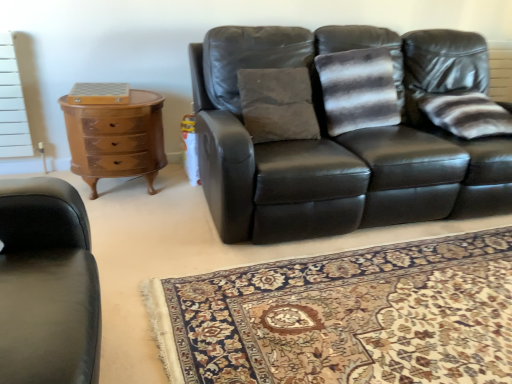
Question: From the image's perspective, is carpet with intricate floral pattern at center over striped fabric pillow at right?

Choices:
 (A) yes
 (B) no

Answer: (B)

Question: Does carpet with intricate floral pattern at center appear on the left side of striped fabric pillow at right?

Choices:
 (A) yes
 (B) no

Answer: (A)

Question: Does carpet with intricate floral pattern at center have a lesser height compared to striped fabric pillow at right?

Choices:
 (A) no
 (B) yes

Answer: (B)

Question: Does carpet with intricate floral pattern at center have a larger size compared to striped fabric pillow at right?

Choices:
 (A) yes
 (B) no

Answer: (A)

Question: Is striped fabric pillow at right surrounded by carpet with intricate floral pattern at center?

Choices:
 (A) no
 (B) yes

Answer: (A)

Question: In terms of height, does carpet with intricate floral pattern at center look taller or shorter compared to matte black leather couch at center?

Choices:
 (A) tall
 (B) short

Answer: (B)

Question: From a real-world perspective, is carpet with intricate floral pattern at center above or below matte black leather couch at center?

Choices:
 (A) above
 (B) below

Answer: (B)

Question: Is carpet with intricate floral pattern at center wider or thinner than matte black leather couch at center?

Choices:
 (A) thin
 (B) wide

Answer: (B)

Question: Is point (271, 372) closer or farther from the camera than point (268, 104)?

Choices:
 (A) farther
 (B) closer

Answer: (B)

Question: Is wooden glossy chest of drawers at left inside or outside of matte black leather couch at center?

Choices:
 (A) inside
 (B) outside

Answer: (B)

Question: From their relative heights in the image, would you say wooden glossy chest of drawers at left is taller or shorter than matte black leather couch at center?

Choices:
 (A) tall
 (B) short

Answer: (B)

Question: Looking at the image, does wooden glossy chest of drawers at left seem bigger or smaller compared to matte black leather couch at center?

Choices:
 (A) big
 (B) small

Answer: (B)

Question: Relative to matte black leather couch at center, is wooden glossy chest of drawers at left in front or behind?

Choices:
 (A) front
 (B) behind

Answer: (B)

Question: Considering the positions of matte black leather couch at center and carpet with intricate floral pattern at center in the image, is matte black leather couch at center taller or shorter than carpet with intricate floral pattern at center?

Choices:
 (A) tall
 (B) short

Answer: (A)

Question: Considering their positions, is matte black leather couch at center located in front of or behind carpet with intricate floral pattern at center?

Choices:
 (A) behind
 (B) front

Answer: (A)